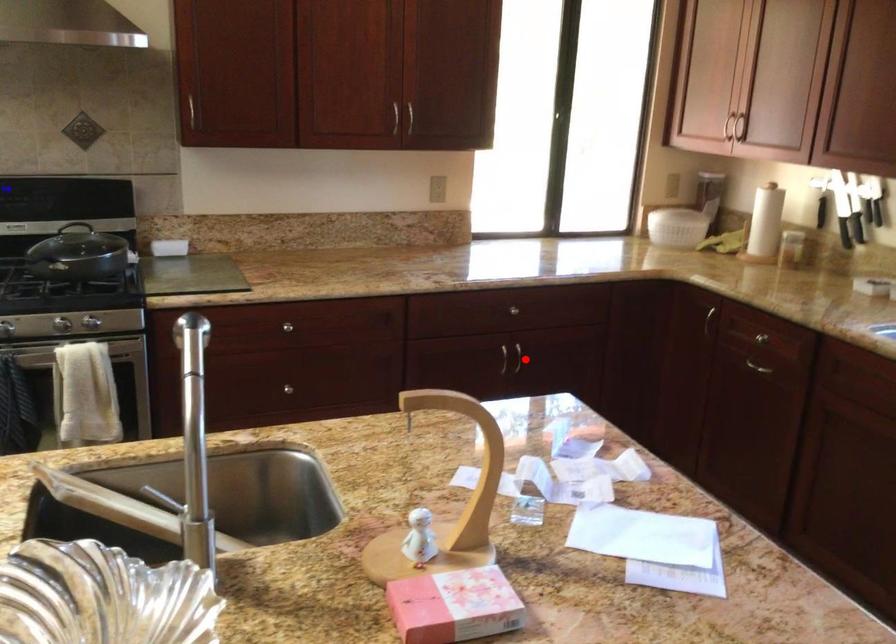
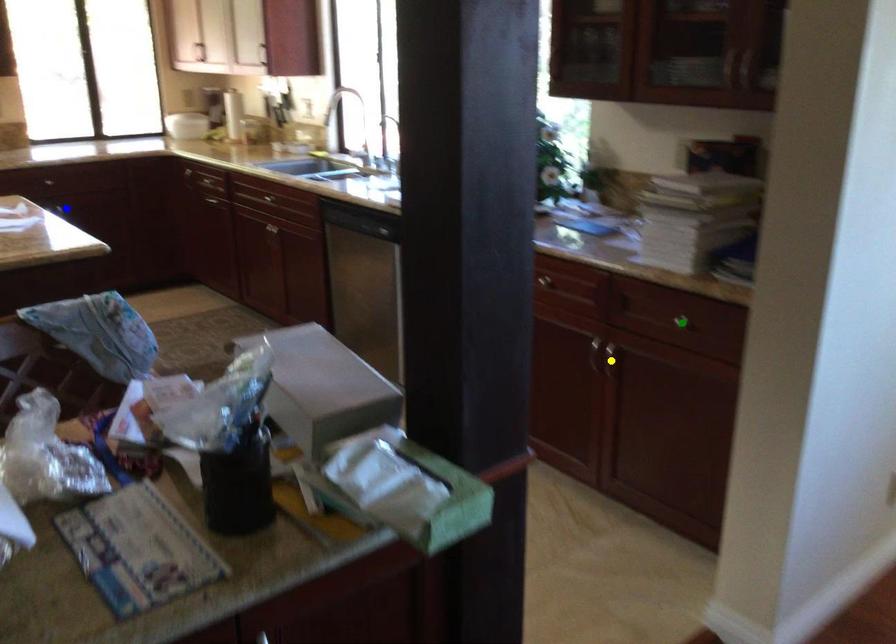
Question: I am providing you with two images of the same scene from different viewpoints. A red point is marked on the first image. You are given multiple points on the second image. Which spot in image 2 lines up with the point in image 1?

Choices:
 (A) yellow point
 (B) green point
 (C) blue point

Answer: (C)